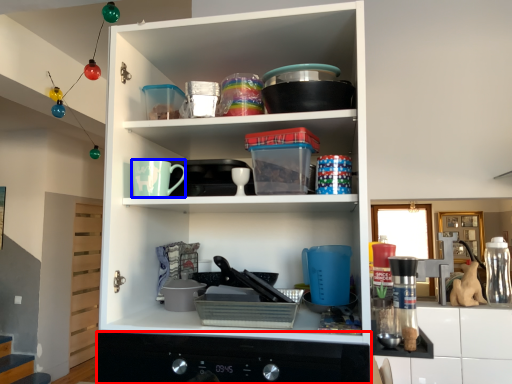
Question: Which object is closer to the camera taking this photo, home appliance (highlighted by a red box) or mug (highlighted by a blue box)?

Choices:
 (A) home appliance
 (B) mug

Answer: (A)